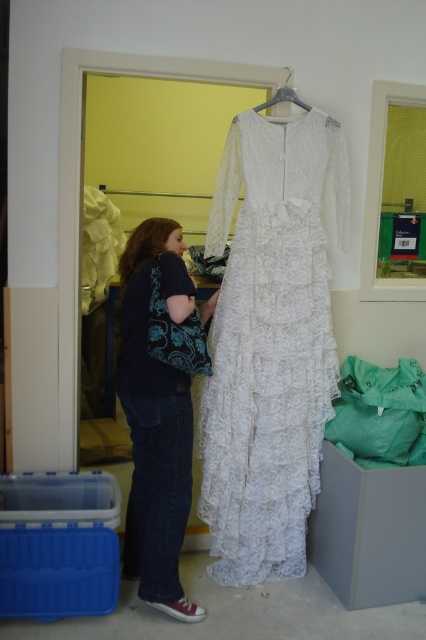
Who is taller, white lace dress at center or black cotton shirt at left?

With more height is white lace dress at center.

Between point (293, 172) and point (143, 305), which one is positioned behind?

The point (293, 172) is behind.

You are a GUI agent. You are given a task and a screenshot of the screen. Output one action in this format:
    pyautogui.click(x=<x>, y=<y>)
    Task: Click on the white lace dress at center
    The image size is (426, 640).
    Given the screenshot: What is the action you would take?
    pos(270,342)